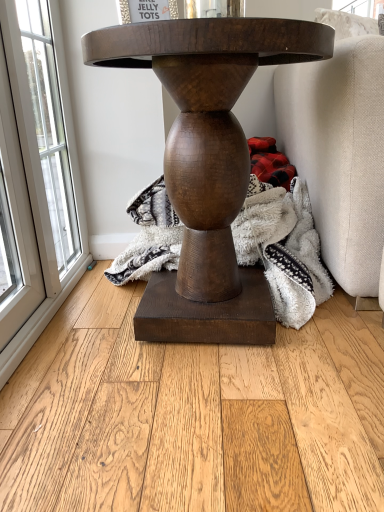
Image resolution: width=384 pixels, height=512 pixels. I want to click on free space in front of fuzzy white blanket at center, so click(195, 422).